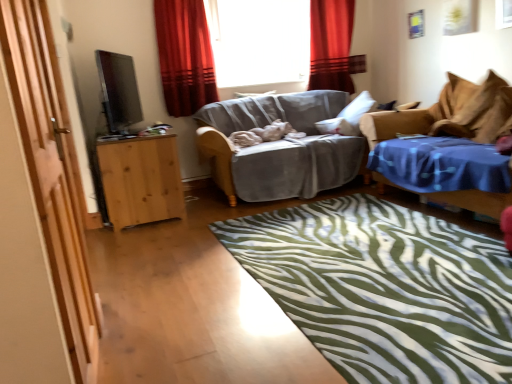
Question: From a real-world perspective, is red velvet curtain at upper center, acting as the second curtain starting from the left, located beneath light brown wooden cabinet at left?

Choices:
 (A) yes
 (B) no

Answer: (B)

Question: Is red velvet curtain at upper center, the 1th curtain positioned from the right, to the left of light brown wooden cabinet at left from the viewer's perspective?

Choices:
 (A) no
 (B) yes

Answer: (A)

Question: Is red velvet curtain at upper center, which is the 1th curtain from back to front, in contact with light brown wooden cabinet at left?

Choices:
 (A) no
 (B) yes

Answer: (A)

Question: Considering the relative sizes of red velvet curtain at upper center, positioned as the 2th curtain in front-to-back order, and light brown wooden cabinet at left in the image provided, is red velvet curtain at upper center, positioned as the 2th curtain in front-to-back order, thinner than light brown wooden cabinet at left?

Choices:
 (A) yes
 (B) no

Answer: (A)

Question: Does red velvet curtain at upper center, the 1th curtain positioned from the right, appear on the right side of light brown wooden cabinet at left?

Choices:
 (A) no
 (B) yes

Answer: (B)

Question: From their relative heights in the image, would you say transparent glass window at center is taller or shorter than red velvet curtain at upper center, the 1th curtain positioned from the right?

Choices:
 (A) tall
 (B) short

Answer: (B)

Question: Is point (307, 4) positioned closer to the camera than point (328, 66)?

Choices:
 (A) closer
 (B) farther

Answer: (B)

Question: Would you say transparent glass window at center is inside or outside red velvet curtain at upper center, positioned as the 2th curtain in front-to-back order?

Choices:
 (A) outside
 (B) inside

Answer: (A)

Question: Based on their sizes in the image, would you say transparent glass window at center is bigger or smaller than red velvet curtain at upper center, positioned as the 2th curtain in front-to-back order?

Choices:
 (A) big
 (B) small

Answer: (A)

Question: Considering the positions of point (189, 24) and point (118, 210), is point (189, 24) closer or farther from the camera than point (118, 210)?

Choices:
 (A) farther
 (B) closer

Answer: (A)

Question: In terms of width, does red velvet curtain at upper center, placed as the 1th curtain when sorted from front to back, look wider or thinner when compared to light brown wooden cabinet at left?

Choices:
 (A) wide
 (B) thin

Answer: (B)

Question: Visually, is red velvet curtain at upper center, positioned as the 2th curtain in right-to-left order, positioned to the left or to the right of light brown wooden cabinet at left?

Choices:
 (A) right
 (B) left

Answer: (A)

Question: From their relative heights in the image, would you say red velvet curtain at upper center, which ranks as the second curtain in back-to-front order, is taller or shorter than light brown wooden cabinet at left?

Choices:
 (A) short
 (B) tall

Answer: (B)

Question: From the image's perspective, is red velvet curtain at upper center, the first curtain viewed from the left, above or below blue fabric studio couch at right, which ranks as the second studio couch in left-to-right order?

Choices:
 (A) above
 (B) below

Answer: (A)

Question: Based on their positions, is red velvet curtain at upper center, the first curtain viewed from the left, located to the left or right of blue fabric studio couch at right, which ranks as the second studio couch in left-to-right order?

Choices:
 (A) left
 (B) right

Answer: (A)